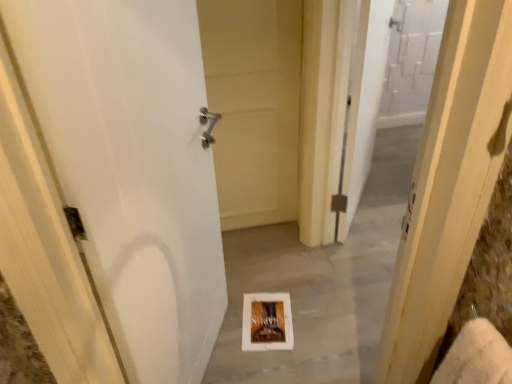
Where is `white matte door at center, the 1th door in the front-to-back sequence`? This screenshot has height=384, width=512. white matte door at center, the 1th door in the front-to-back sequence is located at coordinates (132, 167).

In order to face white paper at center, should I rotate leftwards or rightwards?

Turn right approximately 4.851 degrees to face it.

The width and height of the screenshot is (512, 384). Describe the element at coordinates (254, 106) in the screenshot. I see `white matte door at center, positioned as the second door in front-to-back order` at that location.

At what (x,y) coordinates should I click in order to perform the action: click on white cardboard book at center. Please return your answer as a coordinate pair (x, y). Looking at the image, I should click on (267, 322).

Consider the image. From the image's perspective, is white matte door at center, the second door from the back, above or below white cardboard book at center?

Clearly, from the image's perspective, white matte door at center, the second door from the back, is above white cardboard book at center.

Could you tell me if white matte door at center, the 1th door in the front-to-back sequence, is turned towards white cardboard book at center?

Yes, white matte door at center, the 1th door in the front-to-back sequence, is oriented towards white cardboard book at center.

From a real-world perspective, is white matte door at center, the 1th door in the front-to-back sequence, positioned above or below white cardboard book at center?

Clearly, from a real-world perspective, white matte door at center, the 1th door in the front-to-back sequence, is above white cardboard book at center.

Which of these two, white matte door at center, the second door from the back, or white cardboard book at center, is thinner?

With smaller width is white matte door at center, the second door from the back.

Does white paper at center come behind white matte door at center, the 1th door in the front-to-back sequence?

Yes.

Consider the image. Is white paper at center oriented away from white matte door at center, the 1th door in the front-to-back sequence?

No, white matte door at center, the 1th door in the front-to-back sequence, is not at the back of white paper at center.

What's the angular difference between white paper at center and white matte door at center, the 1th door in the front-to-back sequence,'s facing directions?

The angle between the facing direction of white paper at center and the facing direction of white matte door at center, the 1th door in the front-to-back sequence, is 155 degrees.

Which of these two, white paper at center or white matte door at center, the 1th door in the front-to-back sequence, is thinner?

With smaller width is white matte door at center, the 1th door in the front-to-back sequence.

Is white paper at center oriented away from white cardboard book at center?

Yes, white paper at center's orientation is away from white cardboard book at center.

Considering the positions of objects white paper at center and white cardboard book at center in the image provided, who is behind, white paper at center or white cardboard book at center?

→ white cardboard book at center is behind.

From the picture: Is white paper at center placed right next to white cardboard book at center?

No, white paper at center is not touching white cardboard book at center.

In order to click on concrete that is above the white cardboard book at center (from the image's perspective) in this screenshot , I will do `click(292, 309)`.

Where is `concrete in front of the white matte door at center, the first door in the back-to-front sequence`? concrete in front of the white matte door at center, the first door in the back-to-front sequence is located at coordinates (292, 309).

From the image's perspective, relative to white matte door at center, the first door in the back-to-front sequence, is white paper at center above or below?

Based on their image positions, white paper at center is located beneath white matte door at center, the first door in the back-to-front sequence.

Does point (239, 324) appear closer or farther from the camera than point (224, 200)?

Clearly, point (239, 324) is closer to the camera than point (224, 200).

Can you confirm if white paper at center is positioned to the left of white matte door at center, the first door in the back-to-front sequence?

No, white paper at center is not to the left of white matte door at center, the first door in the back-to-front sequence.

Between white matte door at center, the second door from the back, and white matte door at center, positioned as the second door in front-to-back order, which one has larger size?

white matte door at center, the second door from the back.

Based on the photo, is white matte door at center, the second door from the back, further to the viewer compared to white matte door at center, the first door in the back-to-front sequence?

No, it is not.

From a real-world perspective, is white matte door at center, the second door from the back, located beneath white matte door at center, the first door in the back-to-front sequence?

No, from a real-world perspective, white matte door at center, the second door from the back, is not under white matte door at center, the first door in the back-to-front sequence.

How many degrees apart are the facing directions of white matte door at center, the 1th door in the front-to-back sequence, and white matte door at center, positioned as the second door in front-to-back order?

The angular difference between white matte door at center, the 1th door in the front-to-back sequence, and white matte door at center, positioned as the second door in front-to-back order, is 65.1 degrees.

Is white matte door at center, positioned as the second door in front-to-back order, at the left side of white matte door at center, the second door from the back?

In fact, white matte door at center, positioned as the second door in front-to-back order, is to the right of white matte door at center, the second door from the back.

How distant is white matte door at center, the first door in the back-to-front sequence, from white matte door at center, the second door from the back?

white matte door at center, the first door in the back-to-front sequence, and white matte door at center, the second door from the back, are 29.21 inches apart from each other.

Does white matte door at center, the first door in the back-to-front sequence, have a larger size compared to white matte door at center, the 1th door in the front-to-back sequence?

Incorrect, white matte door at center, the first door in the back-to-front sequence, is not larger than white matte door at center, the 1th door in the front-to-back sequence.

From the picture: Is white matte door at center, the first door in the back-to-front sequence, far away from white matte door at center, the second door from the back?

No, there isn't a large distance between white matte door at center, the first door in the back-to-front sequence, and white matte door at center, the second door from the back.

Can you confirm if white cardboard book at center is positioned to the right of white matte door at center, the second door from the back?

Indeed, white cardboard book at center is positioned on the right side of white matte door at center, the second door from the back.

Considering the relative sizes of white cardboard book at center and white matte door at center, the 1th door in the front-to-back sequence, in the image provided, is white cardboard book at center bigger than white matte door at center, the 1th door in the front-to-back sequence,?

No.

Can you confirm if white cardboard book at center is shorter than white matte door at center, the second door from the back?

Correct, white cardboard book at center is not as tall as white matte door at center, the second door from the back.

Between white cardboard book at center and white matte door at center, the 1th door in the front-to-back sequence, which one is positioned behind?

Positioned behind is white cardboard book at center.

This screenshot has height=384, width=512. There is a white cardboard book at center. Find the location of `the 1st door above it (from the image's perspective)`. the 1st door above it (from the image's perspective) is located at coordinates (132, 167).

At what (x,y) coordinates should I click in order to perform the action: click on door in front of the white paper at center. Please return your answer as a coordinate pair (x, y). The width and height of the screenshot is (512, 384). Looking at the image, I should click on (132, 167).

Based on their spatial positions, is white matte door at center, positioned as the second door in front-to-back order, or white paper at center closer to white cardboard book at center?

The object closer to white cardboard book at center is white paper at center.

Estimate the real-world distances between objects in this image. Which object is closer to white cardboard book at center, white matte door at center, the second door from the back, or white paper at center?

The object closer to white cardboard book at center is white paper at center.

Estimate the real-world distances between objects in this image. Which object is closer to white cardboard book at center, white paper at center or white matte door at center, the first door in the back-to-front sequence?

white paper at center is closer to white cardboard book at center.

Based on their spatial positions, is white matte door at center, positioned as the second door in front-to-back order, or white cardboard book at center further from white matte door at center, the second door from the back?

white matte door at center, positioned as the second door in front-to-back order, is further to white matte door at center, the second door from the back.

When comparing their distances from white matte door at center, the first door in the back-to-front sequence, does white paper at center or white matte door at center, the second door from the back, seem further?

white matte door at center, the second door from the back.

Estimate the real-world distances between objects in this image. Which object is further from white matte door at center, the first door in the back-to-front sequence, white paper at center or white cardboard book at center?

Among the two, white cardboard book at center is located further to white matte door at center, the first door in the back-to-front sequence.

From the image, which object appears to be farther from white paper at center, white cardboard book at center or white matte door at center, the second door from the back?

Among the two, white matte door at center, the second door from the back, is located further to white paper at center.

Which object lies further to the anchor point white matte door at center, the 1th door in the front-to-back sequence, white matte door at center, positioned as the second door in front-to-back order, or white paper at center?

white matte door at center, positioned as the second door in front-to-back order, is positioned further to the anchor white matte door at center, the 1th door in the front-to-back sequence.

Locate an element on the screen. Image resolution: width=512 pixels, height=384 pixels. concrete between white matte door at center, the first door in the back-to-front sequence, and white cardboard book at center from top to bottom is located at coordinates (292, 309).

Image resolution: width=512 pixels, height=384 pixels. I want to click on concrete positioned between white matte door at center, the second door from the back, and white cardboard book at center from near to far, so click(292, 309).

Where is `concrete between white matte door at center, the second door from the back, and white matte door at center, positioned as the second door in front-to-back order, from front to back`? The height and width of the screenshot is (384, 512). concrete between white matte door at center, the second door from the back, and white matte door at center, positioned as the second door in front-to-back order, from front to back is located at coordinates (292, 309).

Identify the location of door between white matte door at center, the 1th door in the front-to-back sequence, and white cardboard book at center in the front-back direction. This screenshot has height=384, width=512. (254, 106).